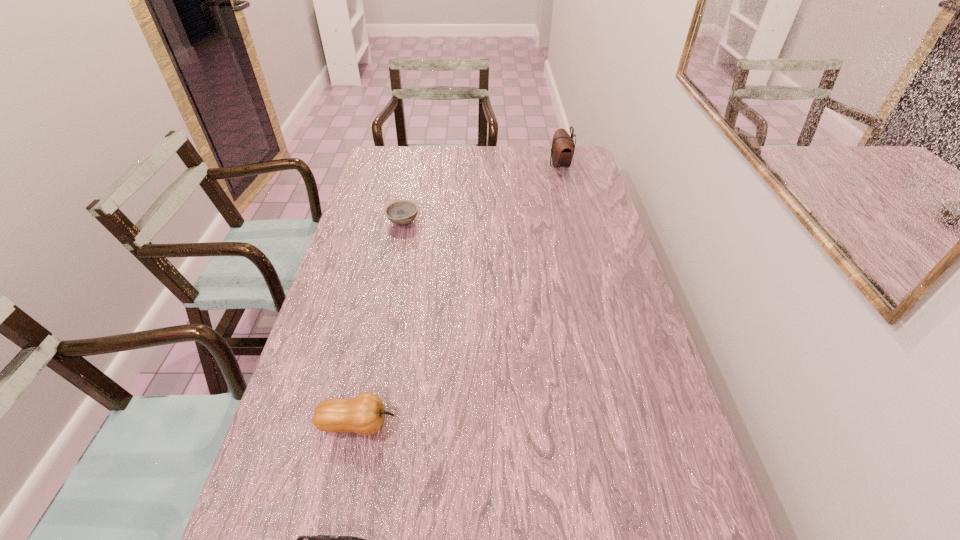
Locate an element on the screen. unoccupied position between the pouch and the third farthest object is located at coordinates (459, 295).

Where is `free spot between the gourd and the bowl`? free spot between the gourd and the bowl is located at coordinates (380, 323).

This screenshot has width=960, height=540. I want to click on free space between the rightmost object and the bowl, so click(x=482, y=194).

Find the location of `free space between the gourd and the farthest object`. free space between the gourd and the farthest object is located at coordinates (459, 295).

This screenshot has height=540, width=960. In order to click on empty space that is in between the bowl and the tallest object in this screenshot , I will do `click(482, 194)`.

At what (x,y) coordinates should I click in order to perform the action: click on unoccupied position between the tallest object and the third shortest object. Please return your answer as a coordinate pair (x, y). This screenshot has height=540, width=960. Looking at the image, I should click on (459, 295).

Find the location of a particular element. The width and height of the screenshot is (960, 540). vacant space in between the pouch and the second farthest object is located at coordinates (482, 194).

Where is `object that is the third closest to the rightmost object`? The image size is (960, 540). object that is the third closest to the rightmost object is located at coordinates (320, 539).

Find the location of a particular element. The image size is (960, 540). the second closest object to the second nearest object is located at coordinates (401, 212).

This screenshot has height=540, width=960. Identify the location of free space that satisfies the following two spatial constraints: 1. with the flap open on the tallest object; 2. on the front side of the third nearest object. tap(574, 222).